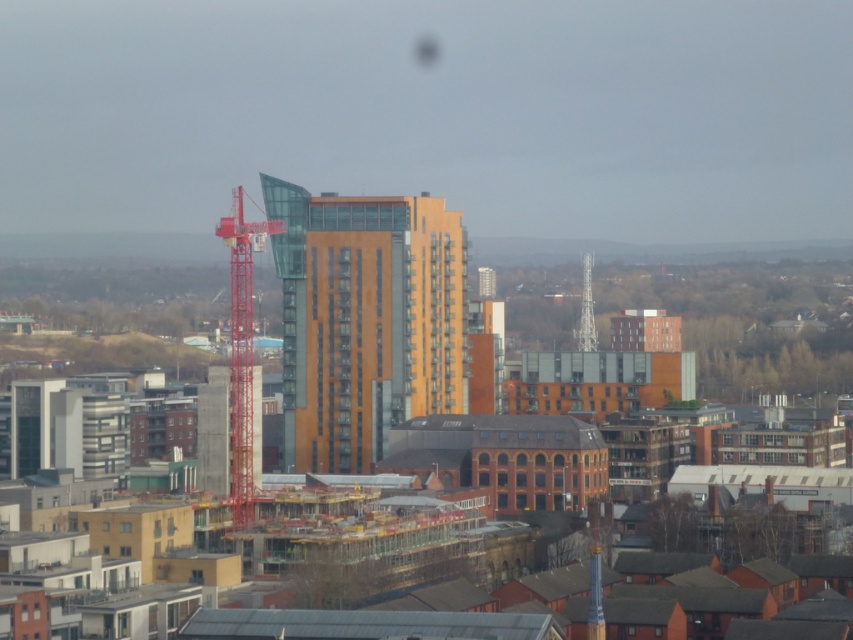
Does red metal crane at left have a greater width compared to metallic silver tower at center?

Yes, red metal crane at left is wider than metallic silver tower at center.

Can you confirm if red metal crane at left is thinner than metallic silver tower at center?

Incorrect, red metal crane at left's width is not less than metallic silver tower at center's.

What do you see at coordinates (242, 348) in the screenshot?
I see `red metal crane at left` at bounding box center [242, 348].

Locate an element on the screen. red metal crane at left is located at coordinates (242, 348).

Between point (444, 236) and point (248, 337), which one is positioned in front?

Point (444, 236) is in front.

From the picture: Is orange glass building at center above red metal crane at left?

Indeed, orange glass building at center is positioned over red metal crane at left.

Locate an element on the screen. orange glass building at center is located at coordinates (364, 320).

Who is more forward, (x=277, y=257) or (x=579, y=344)?

Point (x=277, y=257) is more forward.

Is orange glass building at center positioned at the back of metallic silver tower at center?

No, orange glass building at center is in front of metallic silver tower at center.

Is point (465, 305) less distant than point (585, 316)?

Yes, point (465, 305) is closer to viewer.

Where is `orange glass building at center`? The image size is (853, 640). orange glass building at center is located at coordinates (364, 320).